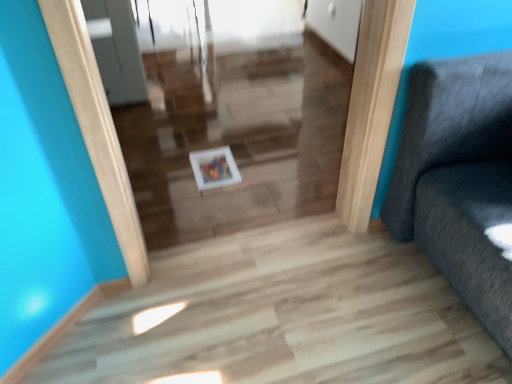
Where is `free space above white glossy picture frame at center (from a real-world perspective)`? free space above white glossy picture frame at center (from a real-world perspective) is located at coordinates (221, 168).